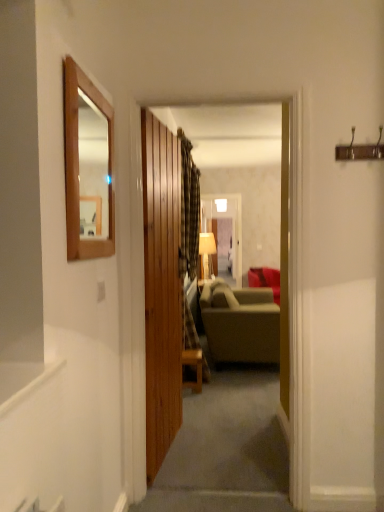
Question: Would you consider wooden door at center to be distant from wooden framed mirror at upper left?

Choices:
 (A) yes
 (B) no

Answer: (B)

Question: Is wooden door at center oriented towards wooden framed mirror at upper left?

Choices:
 (A) yes
 (B) no

Answer: (B)

Question: Is wooden door at center positioned in front of wooden framed mirror at upper left?

Choices:
 (A) yes
 (B) no

Answer: (B)

Question: From the image's perspective, does wooden door at center appear lower than wooden framed mirror at upper left?

Choices:
 (A) yes
 (B) no

Answer: (A)

Question: Does wooden door at center have a greater width compared to wooden framed mirror at upper left?

Choices:
 (A) yes
 (B) no

Answer: (A)

Question: Which is correct: wooden framed mirror at upper left is inside plaid fabric curtain at center, or outside of it?

Choices:
 (A) inside
 (B) outside

Answer: (B)

Question: From a real-world perspective, is wooden framed mirror at upper left positioned above or below plaid fabric curtain at center?

Choices:
 (A) below
 (B) above

Answer: (B)

Question: In the image, is wooden framed mirror at upper left positioned in front of or behind plaid fabric curtain at center?

Choices:
 (A) behind
 (B) front

Answer: (B)

Question: Is point (112, 251) closer or farther from the camera than point (198, 193)?

Choices:
 (A) closer
 (B) farther

Answer: (A)

Question: Which is correct: matte beige lampshade at center is inside matte green fabric couch at center, placed as the second studio couch when sorted from front to back, or outside of it?

Choices:
 (A) inside
 (B) outside

Answer: (B)

Question: Relative to matte green fabric couch at center, placed as the second studio couch when sorted from front to back, is matte beige lampshade at center in front or behind?

Choices:
 (A) front
 (B) behind

Answer: (A)

Question: Does point (208, 247) appear closer or farther from the camera than point (248, 279)?

Choices:
 (A) closer
 (B) farther

Answer: (B)

Question: In terms of height, does matte beige lampshade at center look taller or shorter compared to matte green fabric couch at center, which is counted as the 1th studio couch, starting from the back?

Choices:
 (A) short
 (B) tall

Answer: (A)

Question: Based on their positions, is wooden framed mirror at upper left located to the left or right of wooden table at center?

Choices:
 (A) right
 (B) left

Answer: (B)

Question: In terms of height, does wooden framed mirror at upper left look taller or shorter compared to wooden table at center?

Choices:
 (A) short
 (B) tall

Answer: (B)